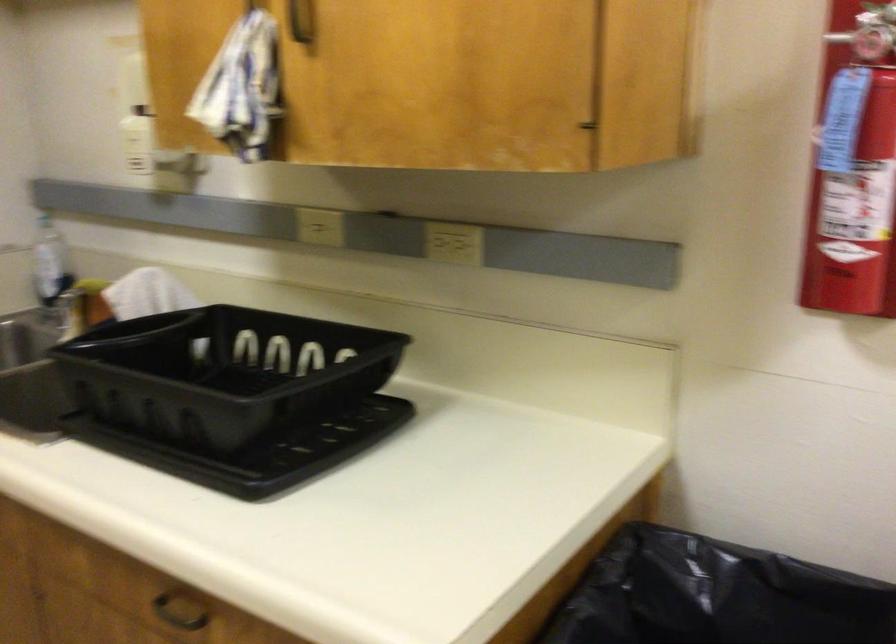
The width and height of the screenshot is (896, 644). What do you see at coordinates (178, 611) in the screenshot?
I see `the black drawer handle` at bounding box center [178, 611].